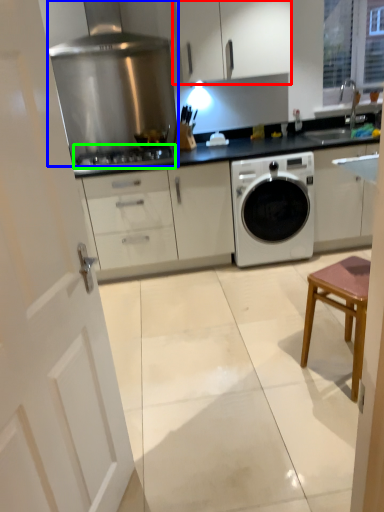
Question: Estimate the real-world distances between objects in this image. Which object is closer to cabinetry (highlighted by a red box), home appliance (highlighted by a blue box) or gas stove (highlighted by a green box)?

Choices:
 (A) home appliance
 (B) gas stove

Answer: (A)